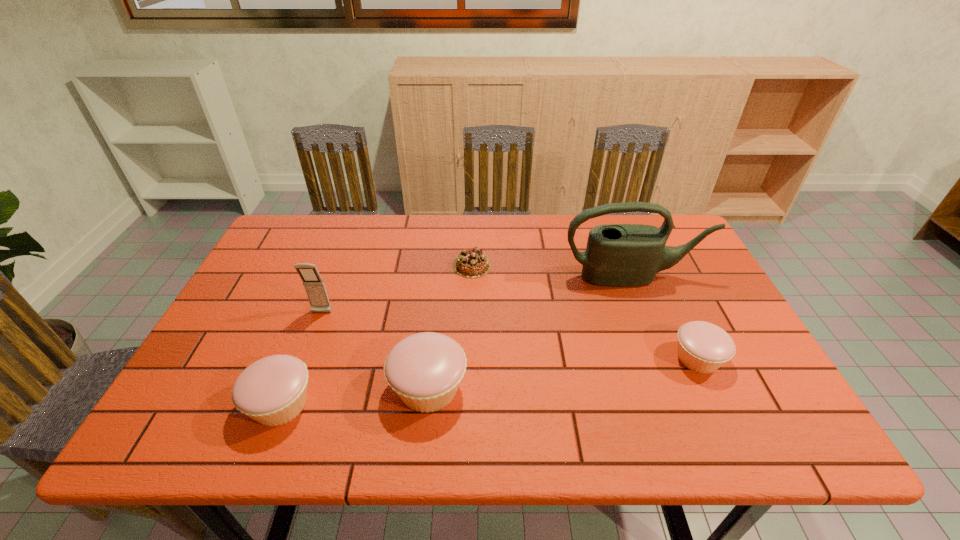
Identify the location of vacant spot for a new cupcake to ensure equal spacing. (567, 373).